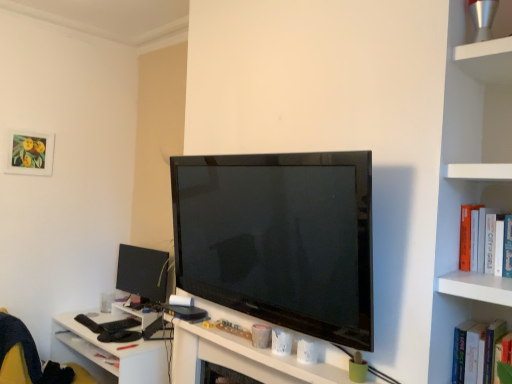
What do you see at coordinates (143, 272) in the screenshot? The height and width of the screenshot is (384, 512). I see `matte black monitor at lower left` at bounding box center [143, 272].

I want to click on white hardcover book at right, so click(475, 238).

The height and width of the screenshot is (384, 512). Find the location of `white matte computer desk at center`. white matte computer desk at center is located at coordinates (247, 358).

The height and width of the screenshot is (384, 512). What are the coordinates of `matte paper picture frame at upper left` in the screenshot? It's located at (30, 154).

From a real-world perspective, between white hardcover book at right and white matte computer desk at center, who is vertically higher?

From a 3D spatial view, white hardcover book at right is above.

Which is behind, point (466, 250) or point (197, 303)?

The point (197, 303) is farther from the camera.

From the image's perspective, which is above, white hardcover book at right or white matte computer desk at center?

white hardcover book at right, from the image's perspective.

Are white hardcover book at right and white matte computer desk at center making contact?

No, white hardcover book at right is not next to white matte computer desk at center.

Considering the relative positions of white glossy table at lower left and white hardcover book at right in the image provided, is white glossy table at lower left in front of white hardcover book at right?

No.

Does point (64, 323) come closer to viewer compared to point (483, 233)?

That is False.

Find the location of a particular element. The image size is (512, 384). book that is above the matte black monitor at lower left (from a real-world perspective) is located at coordinates (475, 238).

Is matte black monitor at lower left at the left side of white hardcover book at right?

Yes.

Who is smaller, matte black monitor at lower left or white hardcover book at right?

white hardcover book at right.

Considering the points (121, 244) and (481, 235), which point is in front, point (121, 244) or point (481, 235)?

The point (481, 235) is more forward.

Can you confirm if matte black monitor at lower left is positioned to the left of white matte computer desk at center?

Indeed, matte black monitor at lower left is positioned on the left side of white matte computer desk at center.

Is matte black monitor at lower left in front of or behind white matte computer desk at center in the image?

Clearly, matte black monitor at lower left is behind white matte computer desk at center.

Looking at this image, is matte black monitor at lower left oriented towards white matte computer desk at center?

No, matte black monitor at lower left does not turn towards white matte computer desk at center.

Which is correct: white hardcover book at right is inside white glossy table at lower left, or outside of it?

white hardcover book at right exists outside the volume of white glossy table at lower left.

How many degrees apart are the facing directions of white hardcover book at right and white glossy table at lower left?

The angle between the facing direction of white hardcover book at right and the facing direction of white glossy table at lower left is 1.22 degrees.

Can you confirm if white hardcover book at right is smaller than white glossy table at lower left?

Yes, white hardcover book at right is smaller than white glossy table at lower left.

Image resolution: width=512 pixels, height=384 pixels. Identify the location of table below the white hardcover book at right (from the image's perspective). (108, 354).

Is white hardcover book at right oriented away from matte black monitor at lower left?

No, white hardcover book at right is not facing away from matte black monitor at lower left.

Considering the points (476, 258) and (157, 298), which point is behind, point (476, 258) or point (157, 298)?

The point (157, 298) is more distant.

From the image's perspective, relative to matte black monitor at lower left, is white hardcover book at right above or below?

white hardcover book at right is situated higher than matte black monitor at lower left in the image.

Between white matte computer desk at center and white glossy table at lower left, which one appears on the left side from the viewer's perspective?

Positioned to the left is white glossy table at lower left.

Is white matte computer desk at center inside or outside of white glossy table at lower left?

white matte computer desk at center is not inside white glossy table at lower left, it's outside.

Is white matte computer desk at center next to white glossy table at lower left?

No, white matte computer desk at center is not with white glossy table at lower left.

Which is behind, white matte computer desk at center or white glossy table at lower left?

white glossy table at lower left is more distant.

Locate an element on the screen. The width and height of the screenshot is (512, 384). book positioned vertically above the white matte computer desk at center (from a real-world perspective) is located at coordinates (475, 238).

Locate an element on the screen. book to the right of white glossy table at lower left is located at coordinates (475, 238).

When comparing their distances from yellow fabric swivel chair at lower left, does white matte computer desk at center or white hardcover book at right seem further?

white hardcover book at right lies further to yellow fabric swivel chair at lower left than the other object.

Considering their positions, is matte paper picture frame at upper left positioned closer to matte black monitor at lower left than yellow fabric swivel chair at lower left?

yellow fabric swivel chair at lower left lies closer to matte black monitor at lower left than the other object.

When comparing their distances from white matte computer desk at center, does white hardcover book at right or white glossy table at lower left seem further?

white hardcover book at right.

Based on their spatial positions, is white hardcover book at right or matte paper picture frame at upper left further from matte black monitor at lower left?

Among the two, white hardcover book at right is located further to matte black monitor at lower left.

Based on their spatial positions, is matte black monitor at lower left or yellow fabric swivel chair at lower left further from matte paper picture frame at upper left?

yellow fabric swivel chair at lower left.

When comparing their distances from matte paper picture frame at upper left, does white matte computer desk at center or yellow fabric swivel chair at lower left seem closer?

yellow fabric swivel chair at lower left.

From the image, which object appears to be farther from yellow fabric swivel chair at lower left, white hardcover book at right or white glossy table at lower left?

white hardcover book at right is further to yellow fabric swivel chair at lower left.

Which object lies further to the anchor point matte paper picture frame at upper left, white glossy table at lower left or white matte computer desk at center?

white matte computer desk at center is further to matte paper picture frame at upper left.

Identify the location of computer monitor located between matte paper picture frame at upper left and white hardcover book at right in the left-right direction. (143, 272).

You are a GUI agent. You are given a task and a screenshot of the screen. Output one action in this format:
    pyautogui.click(x=<x>, y=<y>)
    Task: Click on the computer desk between white hardcover book at right and matte black monitor at lower left in the front-back direction
    This screenshot has width=512, height=384.
    Given the screenshot: What is the action you would take?
    pyautogui.click(x=247, y=358)

This screenshot has height=384, width=512. Find the location of `computer monitor between matte paper picture frame at upper left and white glossy table at lower left from top to bottom`. computer monitor between matte paper picture frame at upper left and white glossy table at lower left from top to bottom is located at coordinates (143, 272).

Find the location of a particular element. Image resolution: width=512 pixels, height=384 pixels. swivel chair between matte paper picture frame at upper left and white glossy table at lower left in the up-down direction is located at coordinates (15, 366).